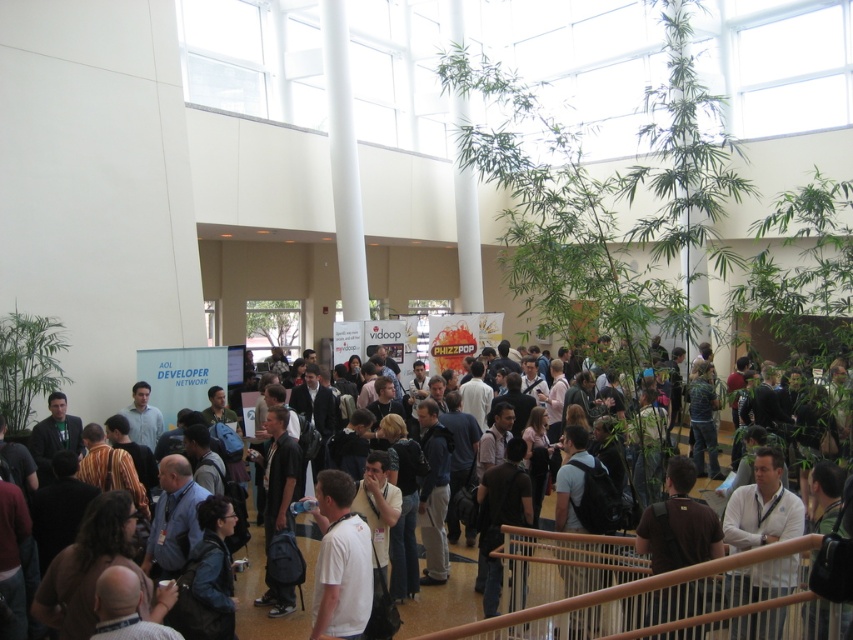
Question: Does dark blue shirt at center appear on the right side of white matte shirt at lower right?

Choices:
 (A) no
 (B) yes

Answer: (A)

Question: Which object appears farthest from the camera in this image?

Choices:
 (A) white matte shirt at lower right
 (B) white matte shirt at center
 (C) dark blue shirt at center
 (D) brown fabric backpack at lower center

Answer: (A)

Question: Is dark blue shirt at center in front of brown fabric backpack at lower center?

Choices:
 (A) no
 (B) yes

Answer: (B)

Question: Which point is closer to the camera?

Choices:
 (A) click(x=651, y=561)
 (B) click(x=648, y=628)
 (C) click(x=363, y=614)

Answer: (B)

Question: Does dark blue shirt at center have a smaller size compared to brown fabric backpack at lower center?

Choices:
 (A) no
 (B) yes

Answer: (A)

Question: Which is nearer to the dark blue shirt at center?

Choices:
 (A) brown fabric backpack at lower center
 (B) white matte shirt at lower right

Answer: (A)